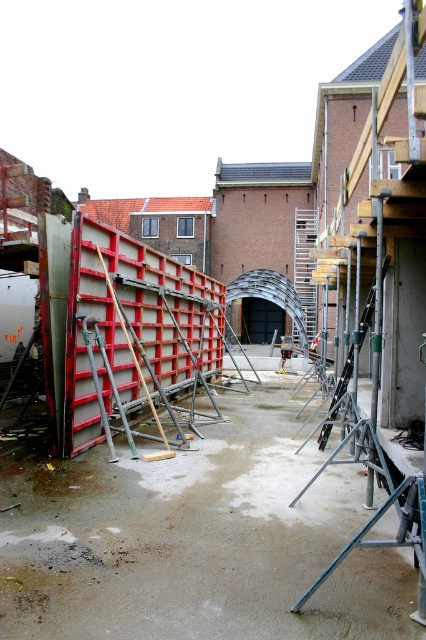
You are a construction worker who needs to move a heavy tool from the metallic gray barrier at center to the metallic silver ladder at center. The tool requires a minimum of 20 meters of space to be moved safely. Can you move it safely?

The metallic gray barrier at center is 19.49 meters from the metallic silver ladder at center. Since the required minimum space is 20 meters, the distance is insufficient. Therefore, you cannot move the tool safely.

You are a construction worker standing at the point labeled point (x=135, y=337). Looking around, you see a large red and white temporary wall on the left and a series of metal scaffolding frames on the right. Which direction should you walk to reach the nearest construction material?

The point (x=135, y=337) is on the metallic gray barrier at center. Since the metallic gray barrier is at the center, the nearest construction materials would be either the metal scaffolding poles and wooden planks leaning against the red and white temporary wall on the left or the series of metal scaffolding frames on the right. However, the description mentions that the point is on the metallic gray barrier at center, so the nearest materials would likely be the scaffolding frames on the right as they are a

You are a construction worker who needs to move a large equipment through the area. The equipment requires a clear path that is wider than the metallic gray barrier at center. Can the equipment pass through the space where the metallic silver ladder at center is located?

The metallic gray barrier at center occupies less space than the metallic silver ladder at center. Since the equipment requires a path wider than the barrier, the space where the metallic silver ladder at center is located may be sufficient, but it depends on the ladder being moved or repositioned to allow clearance.